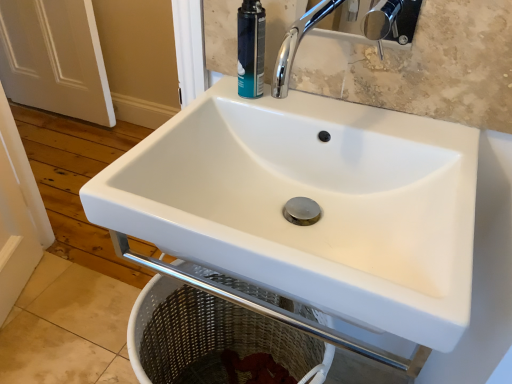
Where is `vacant area situated to the left side of teal matte shaving cream can at upper center`? vacant area situated to the left side of teal matte shaving cream can at upper center is located at coordinates (205, 104).